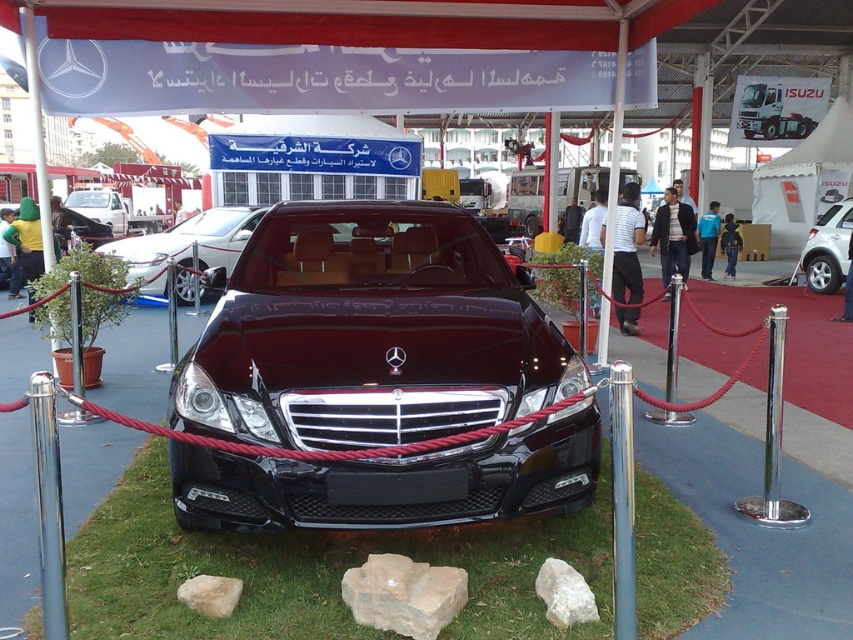
Between point (103, 250) and point (828, 236), which one is positioned behind?

The point (828, 236) is behind.

Does point (152, 280) come farther from viewer compared to point (828, 209)?

No, it is in front of (828, 209).

Is point (212, 220) behind point (828, 244)?

No.

This screenshot has width=853, height=640. I want to click on shiny black car at center, so click(184, 248).

Is light beige stone at lower center above shiny black car at center?

No, light beige stone at lower center is not above shiny black car at center.

Looking at this image, does light beige stone at lower center have a lesser width compared to shiny black car at center?

Yes, light beige stone at lower center is thinner than shiny black car at center.

The height and width of the screenshot is (640, 853). Describe the element at coordinates (403, 595) in the screenshot. I see `light beige stone at lower center` at that location.

The image size is (853, 640). I want to click on light beige stone at lower center, so click(403, 595).

Is light beige stone at lower center to the right of silver metallic sedan at center from the viewer's perspective?

No, light beige stone at lower center is not to the right of silver metallic sedan at center.

Is light beige stone at lower center smaller than silver metallic sedan at center?

Yes.

Between point (421, 620) and point (838, 268), which one is positioned behind?

Point (838, 268)

Locate an element on the screen. light beige stone at lower center is located at coordinates (403, 595).